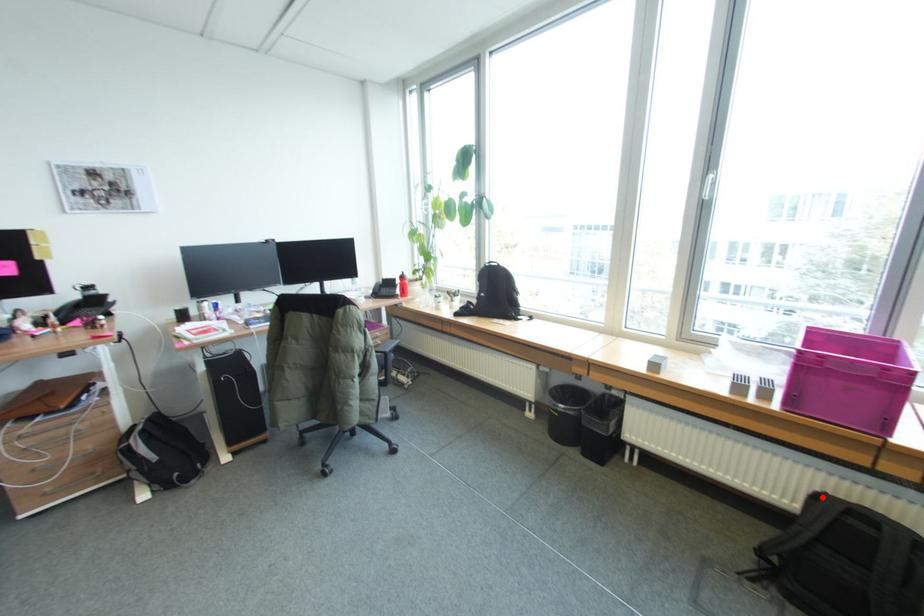
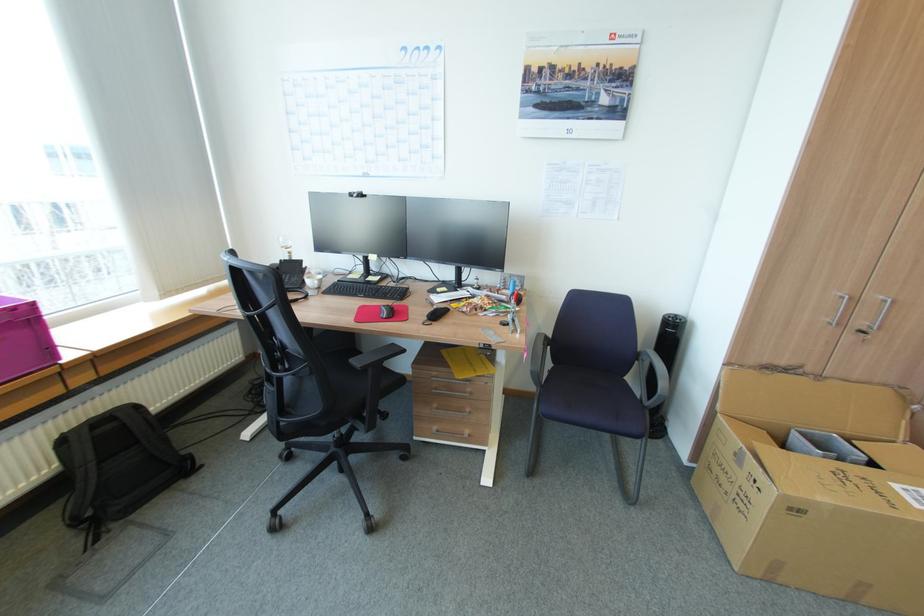
In the second image, find the point that corresponds to the highlighted location in the first image.

(68, 440)